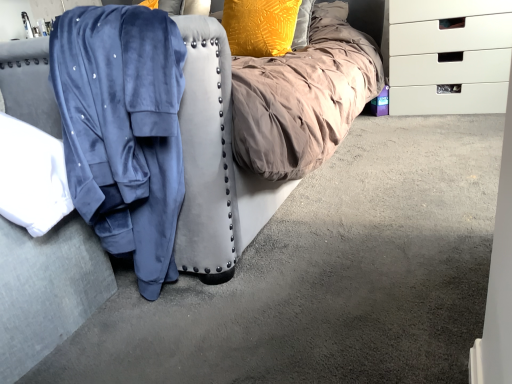
Where is `white plastic chest of drawers at right`? white plastic chest of drawers at right is located at coordinates click(x=450, y=57).

In order to face textured yellow pillow at upper center, should I rotate leftwards or rightwards?

You should look left and rotate roughly 0.256 degrees.

Describe the element at coordinates (217, 187) in the screenshot. This screenshot has height=384, width=512. I see `velvet blue robe at left` at that location.

Where is `white plastic chest of drawers at right`? The image size is (512, 384). white plastic chest of drawers at right is located at coordinates tap(450, 57).

In the image, is velvet blue robe at left on the left side or the right side of velvet blue robe at left?

velvet blue robe at left is positioned on velvet blue robe at left's left side.

Is velvet blue robe at left closer to camera compared to velvet blue robe at left?

Result: No, velvet blue robe at left is further to the viewer.

Is velvet blue robe at left a part of velvet blue robe at left?

No, velvet blue robe at left is not a part of velvet blue robe at left.

Is velvet blue robe at left touching velvet blue robe at left?

No, velvet blue robe at left is not making contact with velvet blue robe at left.

Which object is positioned more to the right, velvet blue robe at left or white plastic chest of drawers at right?

white plastic chest of drawers at right is more to the right.

Which object is wider, velvet blue robe at left or white plastic chest of drawers at right?

Wider between the two is velvet blue robe at left.

In terms of height, does velvet blue robe at left look taller or shorter compared to white plastic chest of drawers at right?

velvet blue robe at left is taller than white plastic chest of drawers at right.

Does velvet blue robe at left come in front of white plastic chest of drawers at right?

Yes, the depth of velvet blue robe at left is less than that of white plastic chest of drawers at right.

Considering the sizes of textured yellow pillow at upper center and white plastic chest of drawers at right in the image, is textured yellow pillow at upper center taller or shorter than white plastic chest of drawers at right?

textured yellow pillow at upper center is shorter than white plastic chest of drawers at right.

The image size is (512, 384). What are the coordinates of `pillow that appears in front of the white plastic chest of drawers at right` in the screenshot? It's located at (260, 26).

Is textured yellow pillow at upper center directly adjacent to white plastic chest of drawers at right?

textured yellow pillow at upper center and white plastic chest of drawers at right are clearly separated.

From a real-world perspective, which object stands above the other?

In real-world perspective, textured yellow pillow at upper center is above.

Does velvet blue robe at left come behind white plastic chest of drawers at right?

That is False.

Which object is positioned more to the left, velvet blue robe at left or white plastic chest of drawers at right?

velvet blue robe at left is more to the left.

Does point (407, 295) lie behind point (435, 21)?

No, (407, 295) is closer to viewer.

Who is shorter, white plastic chest of drawers at right or velvet blue robe at left?

velvet blue robe at left.

Considering the relative positions of white plastic chest of drawers at right and velvet blue robe at left in the image provided, is white plastic chest of drawers at right to the left of velvet blue robe at left from the viewer's perspective?

No, white plastic chest of drawers at right is not to the left of velvet blue robe at left.

Is white plastic chest of drawers at right far from velvet blue robe at left?

white plastic chest of drawers at right is near velvet blue robe at left, not far away.

Is white plastic chest of drawers at right looking in the opposite direction of velvet blue robe at left?

No, white plastic chest of drawers at right's orientation is not away from velvet blue robe at left.

From the image's perspective, is textured yellow pillow at upper center on velvet blue robe at left?

Correct, textured yellow pillow at upper center appears higher than velvet blue robe at left in the image.

Which object is closer to the camera, textured yellow pillow at upper center or velvet blue robe at left?

velvet blue robe at left.

Can you confirm if textured yellow pillow at upper center is smaller than velvet blue robe at left?

Yes, textured yellow pillow at upper center is smaller than velvet blue robe at left.

Is textured yellow pillow at upper center aimed at velvet blue robe at left?

No, textured yellow pillow at upper center is not turned towards velvet blue robe at left.

Is white plastic chest of drawers at right next to velvet blue robe at left and touching it?

No, white plastic chest of drawers at right is not next to velvet blue robe at left.

At what (x,y) coordinates should I click in order to perform the action: click on the chest of drawers located underneath the velvet blue robe at left (from a real-world perspective). Please return your answer as a coordinate pair (x, y). This screenshot has height=384, width=512. Looking at the image, I should click on (450, 57).

Is white plastic chest of drawers at right shorter than velvet blue robe at left?

Indeed, white plastic chest of drawers at right has a lesser height compared to velvet blue robe at left.

From the image's perspective, between white plastic chest of drawers at right and velvet blue robe at left, who is located below?

velvet blue robe at left.

Identify the location of concrete below the velvet blue robe at left (from the image's perspective). The width and height of the screenshot is (512, 384). (326, 276).

I want to click on chest of drawers on the right of the velvet blue robe at left, so click(x=450, y=57).

From the picture: Which object lies further to the anchor point velvet blue robe at left, textured yellow pillow at upper center or white plastic chest of drawers at right?

white plastic chest of drawers at right is positioned further to the anchor velvet blue robe at left.

Looking at this image, from the image, which object appears to be farther from velvet blue robe at left, velvet blue robe at left or white plastic chest of drawers at right?

The object further to velvet blue robe at left is white plastic chest of drawers at right.

From the image, which object appears to be farther from textured yellow pillow at upper center, velvet blue robe at left or velvet blue robe at left?

velvet blue robe at left lies further to textured yellow pillow at upper center than the other object.

Which object lies further to the anchor point white plastic chest of drawers at right, textured yellow pillow at upper center or velvet blue robe at left?

velvet blue robe at left is positioned further to the anchor white plastic chest of drawers at right.

Looking at the image, which one is located further to velvet blue robe at left, white plastic chest of drawers at right or textured yellow pillow at upper center?

→ white plastic chest of drawers at right is further to velvet blue robe at left.

Based on their spatial positions, is white plastic chest of drawers at right or textured yellow pillow at upper center closer to velvet blue robe at left?

white plastic chest of drawers at right lies closer to velvet blue robe at left than the other object.

Considering their positions, is velvet blue robe at left positioned further to white plastic chest of drawers at right than velvet blue robe at left?

velvet blue robe at left lies further to white plastic chest of drawers at right than the other object.

Looking at the image, which one is located further to velvet blue robe at left, velvet blue robe at left or textured yellow pillow at upper center?

textured yellow pillow at upper center is further to velvet blue robe at left.

The width and height of the screenshot is (512, 384). I want to click on concrete located between velvet blue robe at left and white plastic chest of drawers at right in the left-right direction, so click(326, 276).

Where is `furniture between velvet blue robe at left and textured yellow pillow at upper center in the front-back direction`? The image size is (512, 384). furniture between velvet blue robe at left and textured yellow pillow at upper center in the front-back direction is located at coordinates (217, 187).

Find the location of a particular element. pillow between velvet blue robe at left and white plastic chest of drawers at right from front to back is located at coordinates (260, 26).

Where is `pillow between velvet blue robe at left and white plastic chest of drawers at right in the horizontal direction`? The width and height of the screenshot is (512, 384). pillow between velvet blue robe at left and white plastic chest of drawers at right in the horizontal direction is located at coordinates (260, 26).